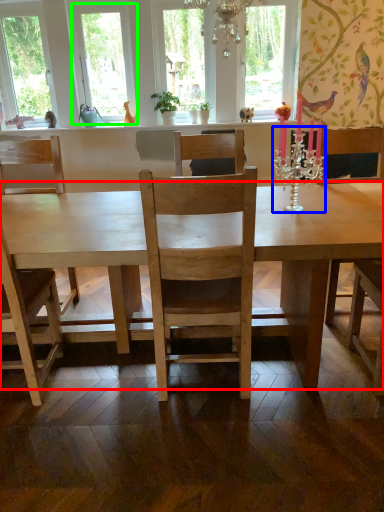
Question: Which is farther away from desk (highlighted by a red box)? candle holder (highlighted by a blue box) or window frame (highlighted by a green box)?

Choices:
 (A) candle holder
 (B) window frame

Answer: (B)